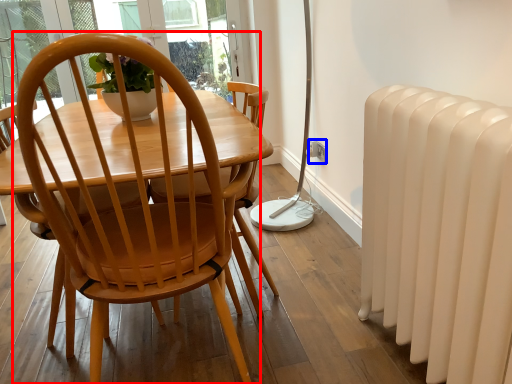
Question: Which object is closer to the camera taking this photo, chair (highlighted by a red box) or power outlet (highlighted by a blue box)?

Choices:
 (A) chair
 (B) power outlet

Answer: (A)